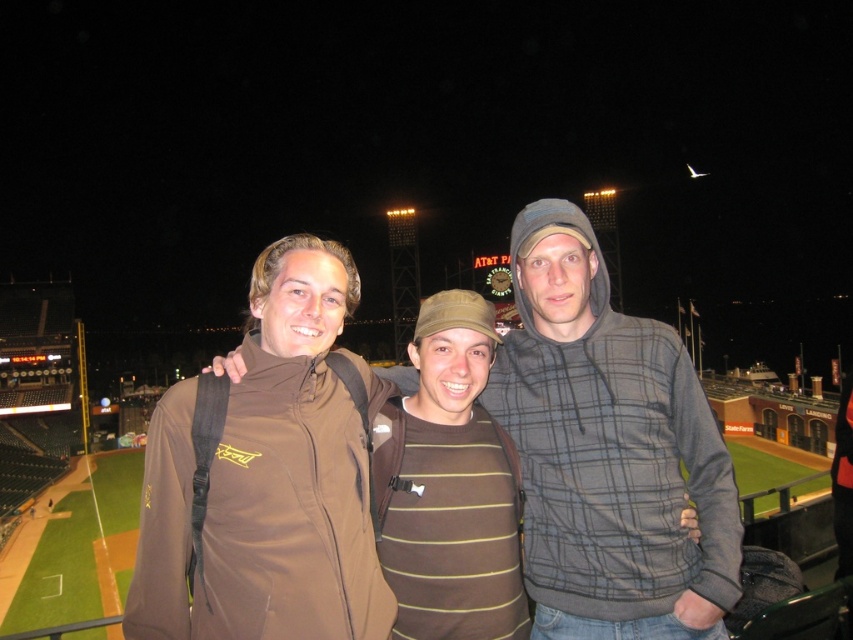
Who is lower down, brown fabric jacket at center or gray plaid hoodie at center?

gray plaid hoodie at center is below.

Which is more to the left, brown fabric jacket at center or gray plaid hoodie at center?

From the viewer's perspective, brown fabric jacket at center appears more on the left side.

Does point (680, 605) lie behind point (502, 362)?

That is False.

Where is `brown fabric jacket at center`? Image resolution: width=853 pixels, height=640 pixels. brown fabric jacket at center is located at coordinates (608, 451).

Between brown fabric jacket at center and brown softshell jacket at center, which one has more height?

brown fabric jacket at center

Does point (541, 372) come closer to viewer compared to point (196, 570)?

That is False.

Describe the element at coordinates (608, 451) in the screenshot. I see `brown fabric jacket at center` at that location.

The image size is (853, 640). I want to click on brown fabric jacket at center, so click(608, 451).

Between gray plaid hoodie at center and brown softshell jacket at center, which one appears on the left side from the viewer's perspective?

brown softshell jacket at center is more to the left.

Who is shorter, gray plaid hoodie at center or brown softshell jacket at center?

brown softshell jacket at center

What do you see at coordinates (608, 451) in the screenshot? The width and height of the screenshot is (853, 640). I see `gray plaid hoodie at center` at bounding box center [608, 451].

Where is `gray plaid hoodie at center`? Image resolution: width=853 pixels, height=640 pixels. gray plaid hoodie at center is located at coordinates (608, 451).